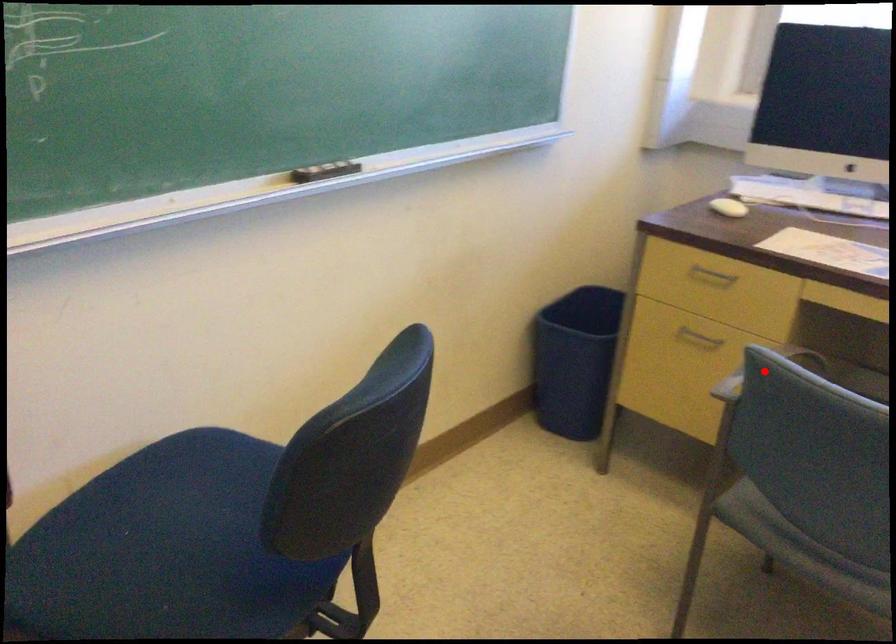
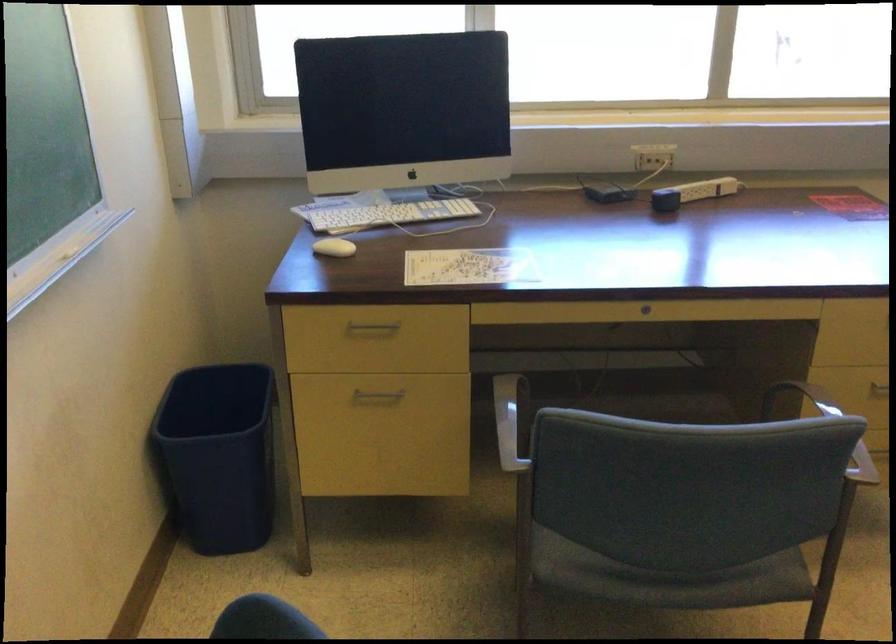
Where in the second image is the point corresponding to the highlighted location from the first image?

(511, 421)